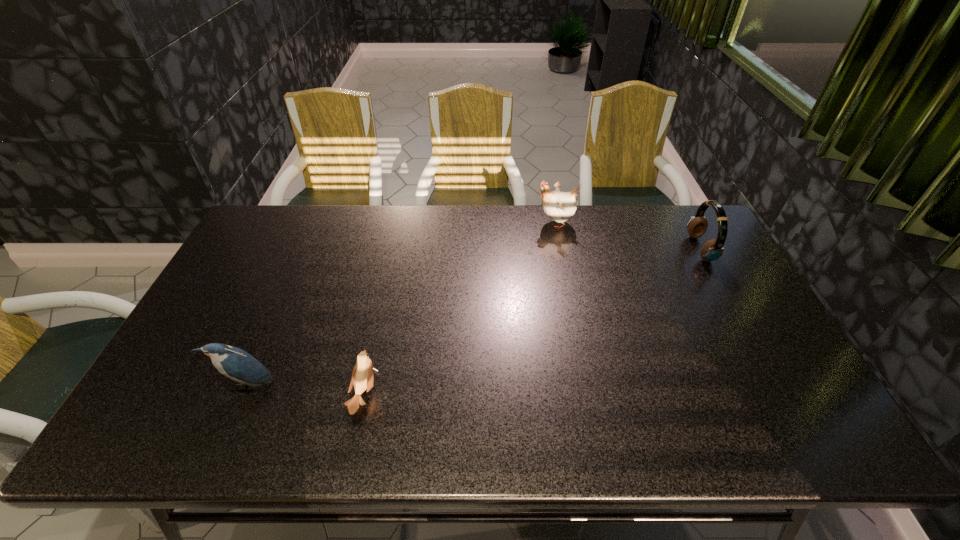
The image size is (960, 540). In order to click on the third object from left to right in this screenshot , I will do `click(559, 206)`.

Image resolution: width=960 pixels, height=540 pixels. In order to click on the farthest bird in this screenshot , I will do `click(559, 206)`.

This screenshot has height=540, width=960. Find the location of `the rightmost object`. the rightmost object is located at coordinates (712, 250).

At what (x,y) coordinates should I click in order to perform the action: click on the leftmost bird. Please return your answer as a coordinate pair (x, y). Looking at the image, I should click on (238, 365).

Locate an element on the screen. This screenshot has width=960, height=540. the second object from left to right is located at coordinates (362, 377).

Identify the location of the shortest bird. (362, 377).

The width and height of the screenshot is (960, 540). I want to click on free region located at the beak of the farthest bird, so pyautogui.click(x=492, y=223).

Where is `free space located 0.310m at the beak of the farthest bird`? This screenshot has width=960, height=540. free space located 0.310m at the beak of the farthest bird is located at coordinates (446, 223).

Find the location of a particular element. The height and width of the screenshot is (540, 960). vacant point located 0.110m at the beak of the farthest bird is located at coordinates (503, 223).

At what (x,y) coordinates should I click in order to perform the action: click on vacant region located on the ear cup of the rightmost object. Please return your answer as a coordinate pair (x, y). Looking at the image, I should click on (624, 249).